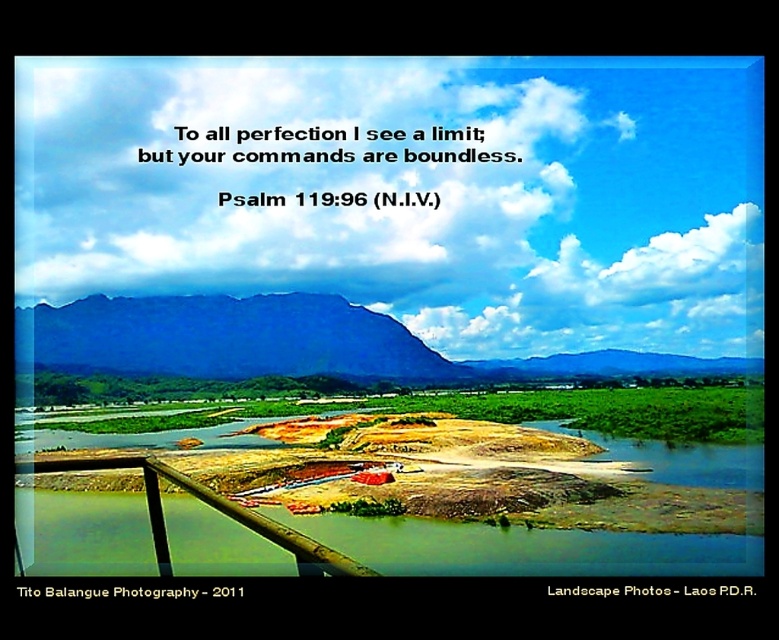
You are a photographer planning to capture the entire landscape scene. You notice the white fluffy cloud at upper center. Based on its position, will it be included in your photo if you frame the scene using the rule of thirds grid? Explain your reasoning.

The white fluffy cloud at upper center is positioned at coordinates approximately 0.298 along the horizontal axis and 0.526 along the vertical axis. The rule of thirds divides the image into a 3x3 grid, with intersection points at approximately 1.333 and 2.666 on each axis. Since the cloud is near the center of the grid, it would not align with any of the rule of thirds intersection points. Therefore, if strictly following the rule of thirds, the cloud might be slightly off the ideal compositional points,

You are standing at the sandy island in the image and want to know how far the white fluffy cloud at upper center is from you. Can you determine the distance?

The distance of white fluffy cloud at upper center from viewer is 1055.68 feet.